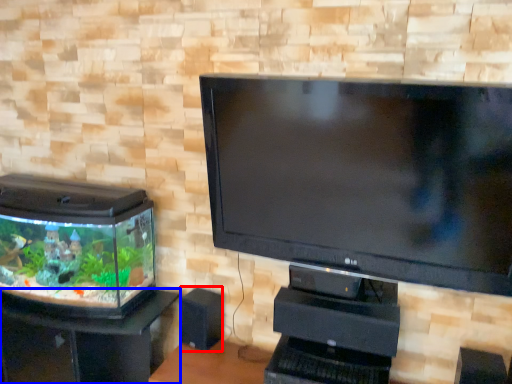
Question: Which object is closer to the camera taking this photo, speaker (highlighted by a red box) or furniture (highlighted by a blue box)?

Choices:
 (A) speaker
 (B) furniture

Answer: (B)